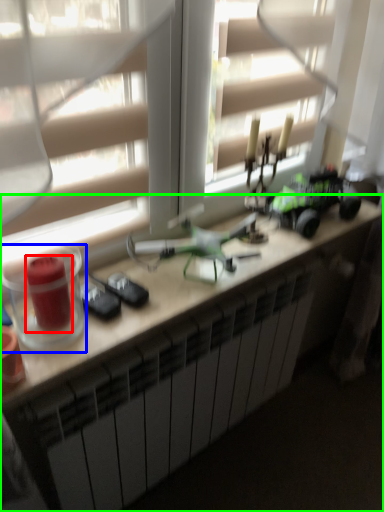
Question: Based on their relative distances, which object is farther from candle holder (highlighted by a red box)? Choose from candle holder (highlighted by a blue box) and desk (highlighted by a green box).

Choices:
 (A) candle holder
 (B) desk

Answer: (B)